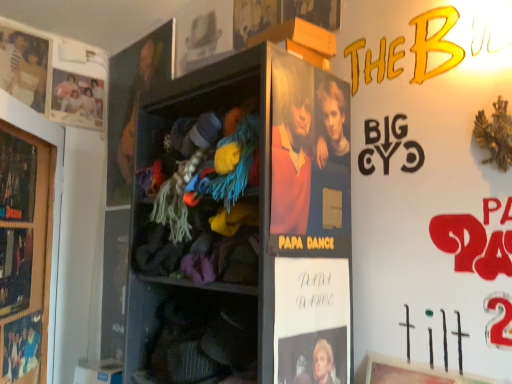
Question: Does matte paper movie poster at upper center, which appears as the fourth movie poster when ordered from the bottom, have a larger size compared to matte paper poster at center, the third person viewed from the back?

Choices:
 (A) yes
 (B) no

Answer: (B)

Question: Considering the relative positions of matte paper movie poster at upper center, which appears as the fourth movie poster when ordered from the bottom, and matte paper poster at center, the third person viewed from the back, in the image provided, is matte paper movie poster at upper center, which appears as the fourth movie poster when ordered from the bottom, to the left of matte paper poster at center, the third person viewed from the back, from the viewer's perspective?

Choices:
 (A) no
 (B) yes

Answer: (B)

Question: Is matte paper poster at center, acting as the first person starting from the front, completely or partially inside matte paper movie poster at upper center, the 4th movie poster positioned from the left?

Choices:
 (A) no
 (B) yes

Answer: (A)

Question: Is matte paper movie poster at upper center, the 1th movie poster positioned from the top, closer to camera compared to matte paper poster at center, acting as the first person starting from the front?

Choices:
 (A) yes
 (B) no

Answer: (B)

Question: From a real-world perspective, is matte paper movie poster at upper center, the 1th movie poster positioned from the top, beneath matte paper poster at center, the 3th person viewed from the left?

Choices:
 (A) no
 (B) yes

Answer: (A)

Question: Is the surface of matte paper movie poster at upper center, which appears as the fourth movie poster when ordered from the bottom, in direct contact with matte paper poster at center, the 3th person viewed from the left?

Choices:
 (A) no
 (B) yes

Answer: (A)

Question: Does matte black poster at left, arranged as the 2th advertisement when viewed from the left, have a smaller size compared to matte paper poster at upper left, the 3th movie poster from the top?

Choices:
 (A) no
 (B) yes

Answer: (B)

Question: Is matte black poster at left, which is counted as the 2th advertisement, starting from the right, bigger than matte paper poster at upper left, which ranks as the second movie poster in bottom-to-top order?

Choices:
 (A) no
 (B) yes

Answer: (A)

Question: Is matte black poster at left, which is counted as the 2th advertisement, starting from the right, positioned with its back to matte paper poster at upper left, acting as the 4th movie poster starting from the right?

Choices:
 (A) no
 (B) yes

Answer: (A)

Question: From the image's perspective, is matte black poster at left, arranged as the 2th advertisement when viewed from the left, located beneath matte paper poster at upper left, acting as the 4th movie poster starting from the right?

Choices:
 (A) no
 (B) yes

Answer: (B)

Question: Is matte black poster at left, which is counted as the 2th advertisement, starting from the right, not close to matte paper poster at upper left, the 3th movie poster from the top?

Choices:
 (A) no
 (B) yes

Answer: (A)

Question: Are matte black poster at left, which is counted as the 2th advertisement, starting from the right, and matte paper poster at upper left, acting as the 4th movie poster starting from the right, beside each other?

Choices:
 (A) no
 (B) yes

Answer: (A)

Question: From the image's perspective, does matte black poster at left, which is counted as the 2th advertisement, starting from the right, appear higher than matte black guitar at upper left, the 2th person in the front-to-back sequence?

Choices:
 (A) yes
 (B) no

Answer: (B)